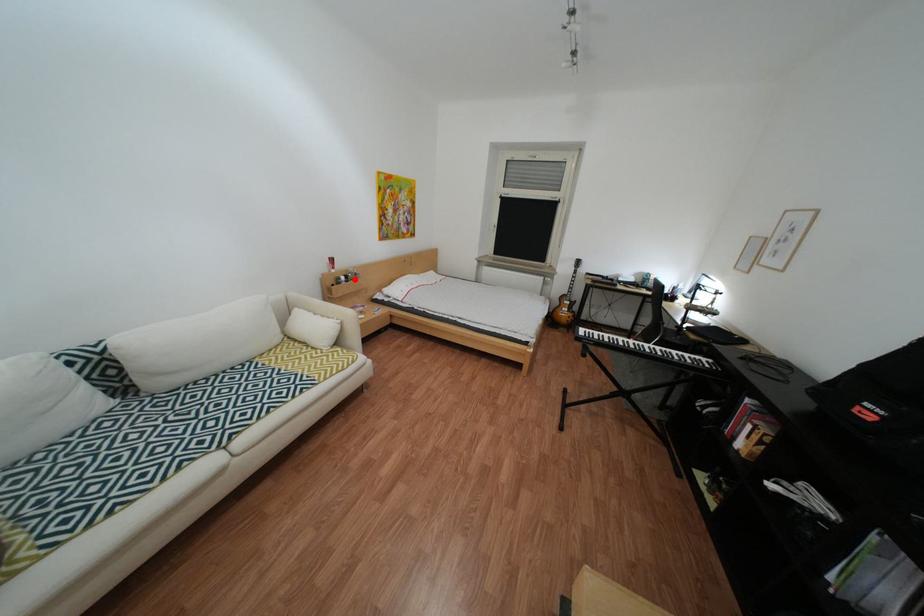
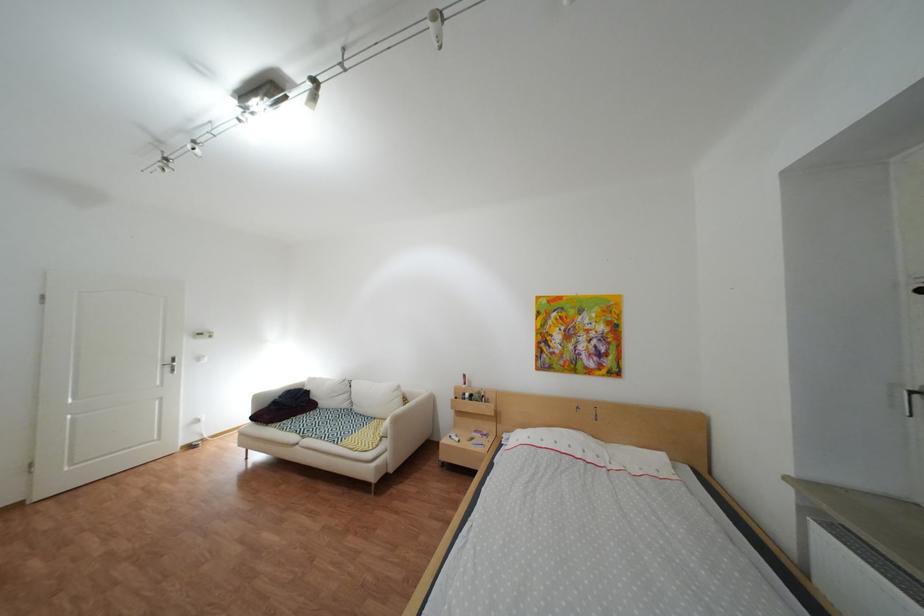
The point at the highlighted location is marked in the first image. Where is the corresponding point in the second image?

(480, 395)